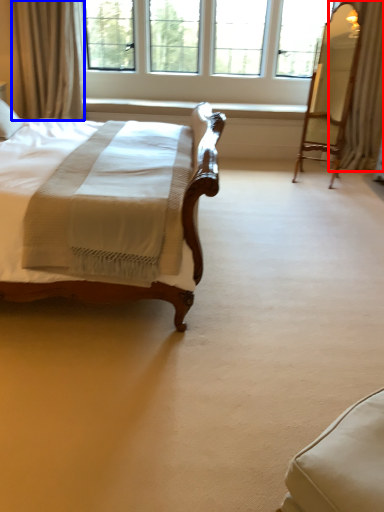
Question: Among these objects, which one is nearest to the camera, curtain (highlighted by a red box) or curtain (highlighted by a blue box)?

Choices:
 (A) curtain
 (B) curtain

Answer: (A)